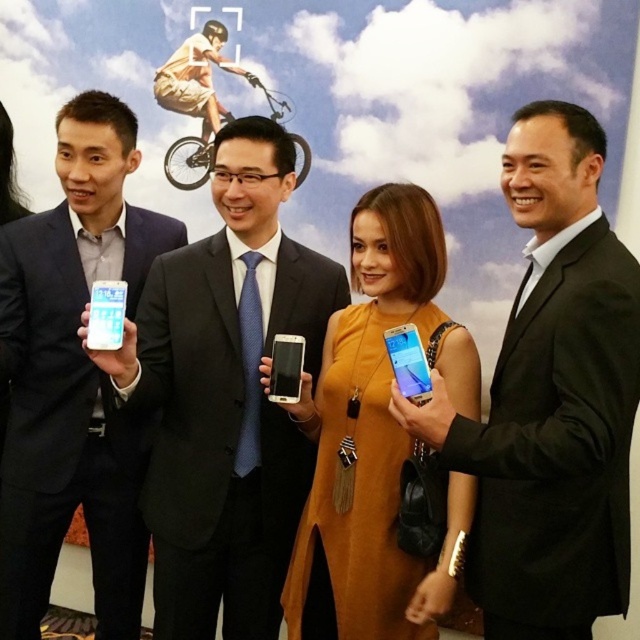
You are a photographer at the event and want to capture both the matte black suit at center and the orange suede dress at center in a single photo. Which one should you focus on to ensure the other is also in focus?

You should focus on the matte black suit at center because it is in front of the orange suede dress at center, so focusing on the closer object will keep both in focus.

You are a photographer at the event and need to capture a photo of both the matte black suit at center and the orange suede dress at center without any obstruction between them. Given that your camera has a maximum focus range of 10 inches, will you be able to capture both subjects clearly in the same frame?

The matte black suit at center is 10.18 inches away from the orange suede dress at center. Since the distance exceeds the camera maximum focus range of 10 inches, you won not be able to capture both subjects clearly in the same frame.

You are a photographer adjusting your camera to focus on two specific points in the image. The first point is at coordinates point (593, 410) and the second is at point (289, 387). Which point should you focus on first if you want to capture the closest one to the camera?

Point (593, 410) is closer to the camera than point (289, 387), so you should focus on point (593, 410) first.